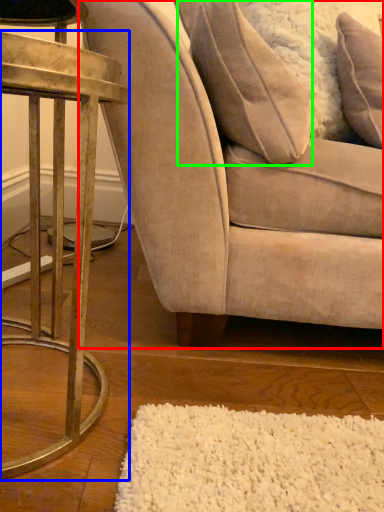
Question: Which object is positioned farthest from chair (highlighted by a red box)? Select from table (highlighted by a blue box) and pillow (highlighted by a green box).

Choices:
 (A) table
 (B) pillow

Answer: (A)